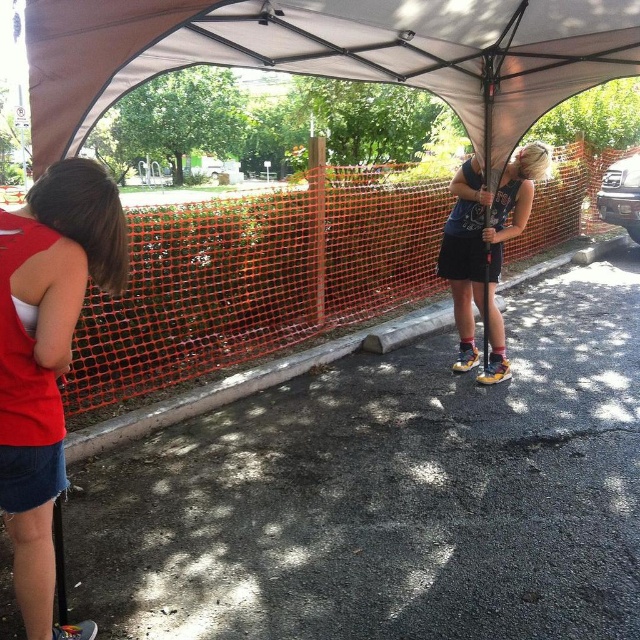
You are standing under the large canopy tent and want to place a small potted plant on the ground near the matte blue tank top at center. However, you need to ensure that the plant won not be directly under the brown fabric tent at upper center. Can you do this?

The brown fabric tent at upper center is positioned over the matte blue tank top at center, so placing the plant near the matte blue tank top at center would still place it under the tent. Therefore, the plant would be directly under the tent, making it impossible to avoid.

You are standing under the brown fabric tent at upper center and want to see the matte blue tank top at center. In which direction should you look?

You should look to the right because the brown fabric tent at upper center is to the left of the matte blue tank top at center.